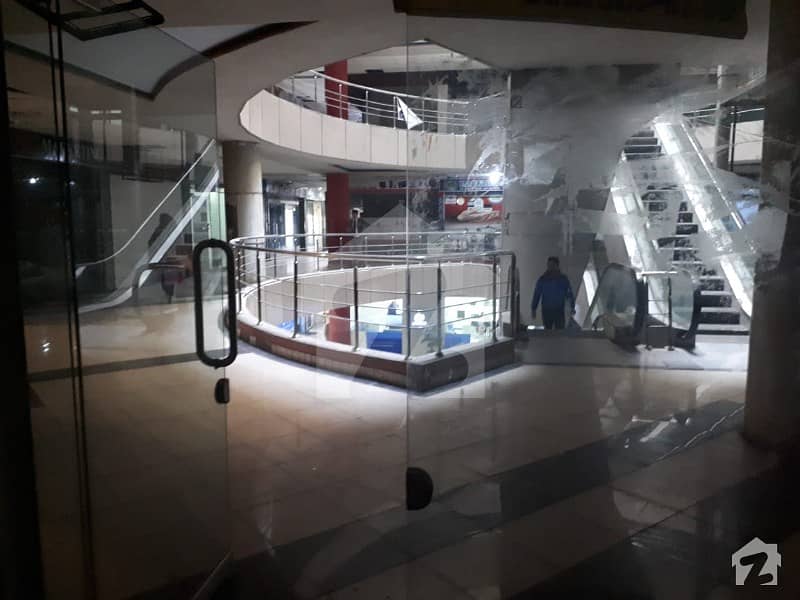
This screenshot has height=600, width=800. What are the coordinates of `ceilings` in the screenshot? It's located at (202, 36).